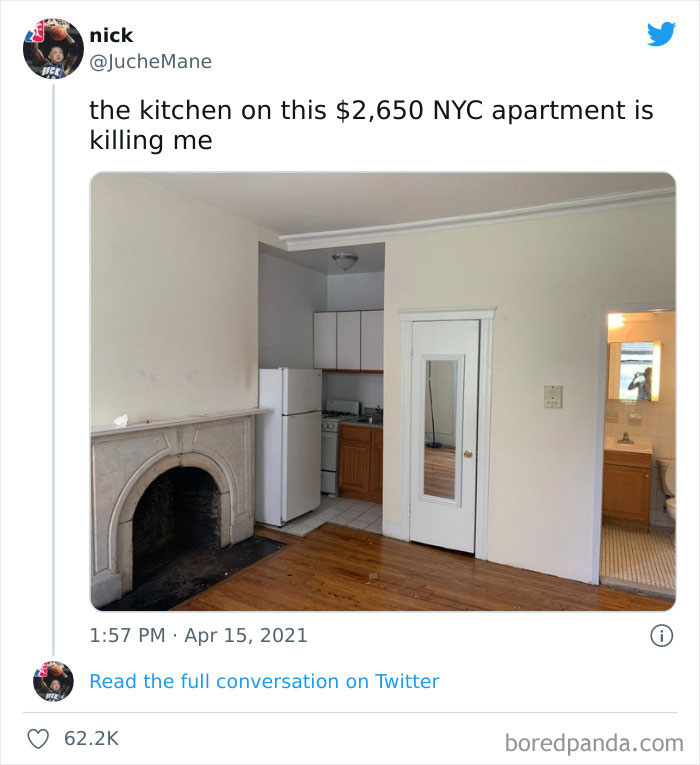
You are a GUI agent. You are given a task and a screenshot of the screen. Output one action in this format:
    pyautogui.click(x=<x>, y=<y>)
    Task: Click on the fireplace
    
    Given the screenshot: What is the action you would take?
    pyautogui.click(x=192, y=509)